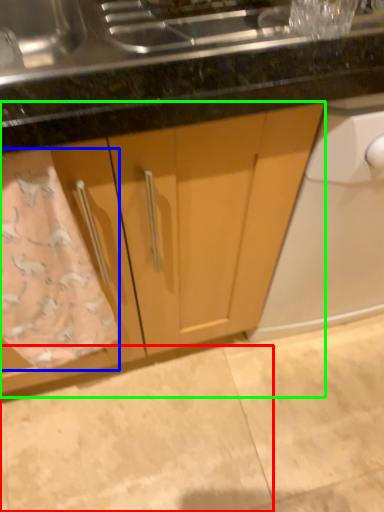
Question: Based on their relative distances, which object is farther from granite (highlighted by a red box)? Choose from bath towel (highlighted by a blue box) and cabinetry (highlighted by a green box).

Choices:
 (A) bath towel
 (B) cabinetry

Answer: (A)